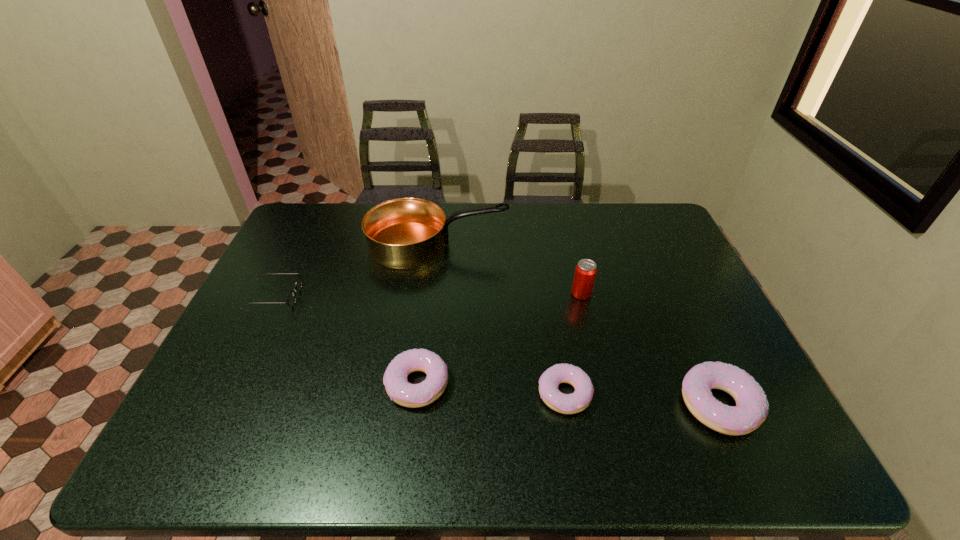
Where is `vacant area situated 0.210m on the left of the leftmost doughnut`? Image resolution: width=960 pixels, height=540 pixels. vacant area situated 0.210m on the left of the leftmost doughnut is located at coordinates (299, 384).

Image resolution: width=960 pixels, height=540 pixels. What are the coordinates of `free space located on the back of the fourth object from left to right` in the screenshot? It's located at (557, 346).

Locate an element on the screen. free space located on the back of the rightmost doughnut is located at coordinates (692, 347).

What are the coordinates of `vacant space situated 0.110m on the handle side of the frying pan` in the screenshot? It's located at (540, 245).

In order to click on vacant position located on the back of the second object from right to left in this screenshot , I will do `click(566, 233)`.

Where is `vacant space located 0.290m through the lenses of the spectacles`? The image size is (960, 540). vacant space located 0.290m through the lenses of the spectacles is located at coordinates (398, 297).

At what (x,y) coordinates should I click in order to perform the action: click on object at the far edge. Please return your answer as a coordinate pair (x, y). This screenshot has height=540, width=960. Looking at the image, I should click on (403, 233).

Image resolution: width=960 pixels, height=540 pixels. I want to click on object that is at the left edge, so click(x=291, y=300).

Image resolution: width=960 pixels, height=540 pixels. I want to click on object that is at the right edge, so click(751, 410).

What are the coordinates of `object that is at the near right corner` in the screenshot? It's located at (751, 410).